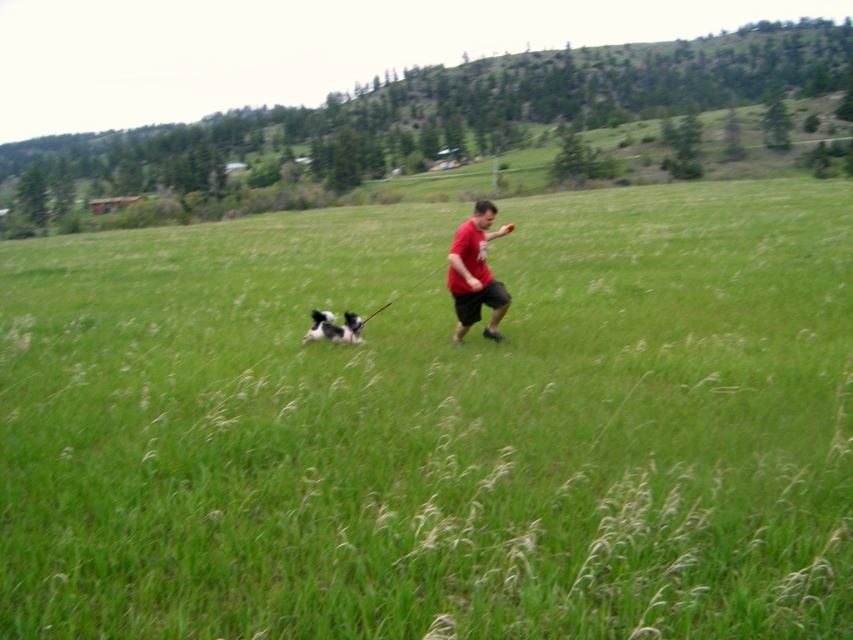
Question: Which point is farther from the camera taking this photo?

Choices:
 (A) (488, 216)
 (B) (316, 316)

Answer: (B)

Question: Does red matte shirt at center have a lesser width compared to black and white fur at center?

Choices:
 (A) yes
 (B) no

Answer: (B)

Question: Does green grassy field at center appear over black and white fur at center?

Choices:
 (A) no
 (B) yes

Answer: (B)

Question: Can you confirm if green grassy field at center is smaller than black and white fur at center?

Choices:
 (A) no
 (B) yes

Answer: (A)

Question: Which point is closer to the camera taking this photo?

Choices:
 (A) (477, 220)
 (B) (347, 336)
 (C) (563, 547)

Answer: (C)

Question: Which point is closer to the camera?

Choices:
 (A) black and white fur at center
 (B) red matte shirt at center

Answer: (B)